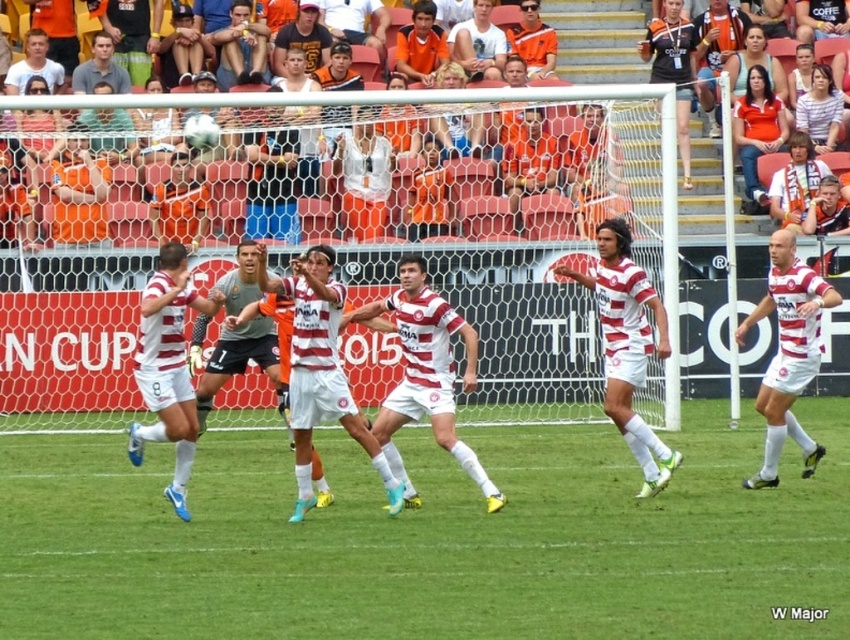
You are a soccer player standing on the field and see the green grass at center and the matte black jersey at center. Which object is located lower in the image?

The green grass at center is located lower than the matte black jersey at center in the image.

You are a drone operator trying to capture aerial footage of the soccer match. You notice the green grass at center and the white matte soccer player at center in your camera view. Which object will appear larger in your footage?

The green grass at center will appear larger in the footage because it is closer to the viewer than the white matte soccer player at center.